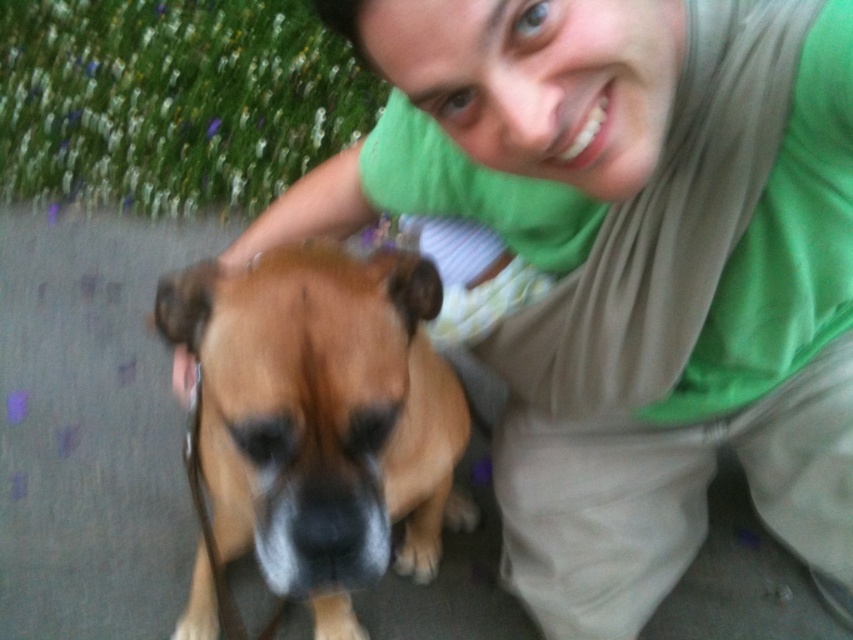
Is green fabric shirt at upper center bigger than brown fur dog at center?

Yes, green fabric shirt at upper center is bigger than brown fur dog at center.

Which is behind, point (612, 428) or point (260, 556)?

Positioned behind is point (612, 428).

Does point (630, 429) come in front of point (378, 396)?

No, (630, 429) is behind (378, 396).

Where is `green fabric shirt at upper center`? The width and height of the screenshot is (853, 640). green fabric shirt at upper center is located at coordinates (630, 266).